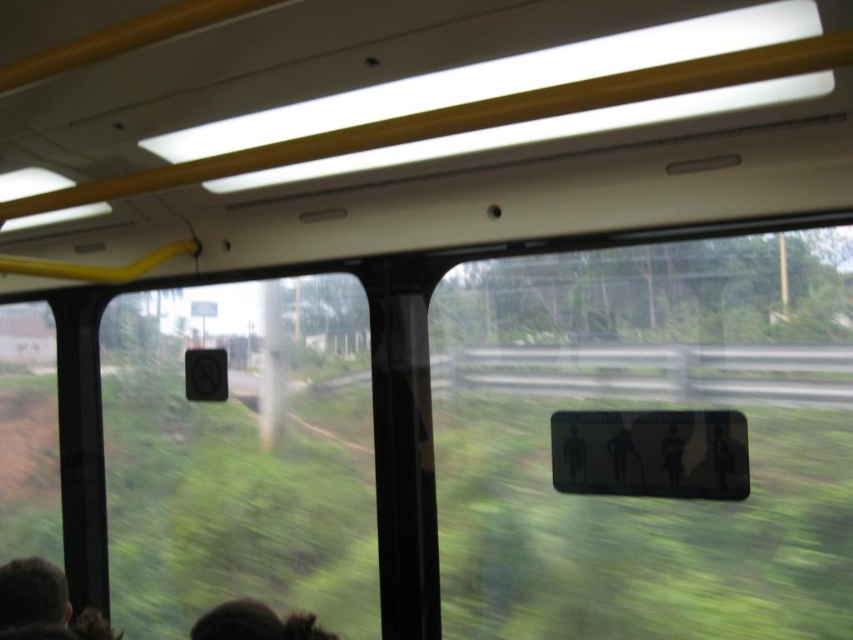
Is transparent plastic sign at center thinner than dark brown hair at lower left?

No.

Is transparent plastic sign at center further to the viewer compared to dark brown hair at lower left?

Yes.

Locate an element on the screen. transparent plastic sign at center is located at coordinates (647, 440).